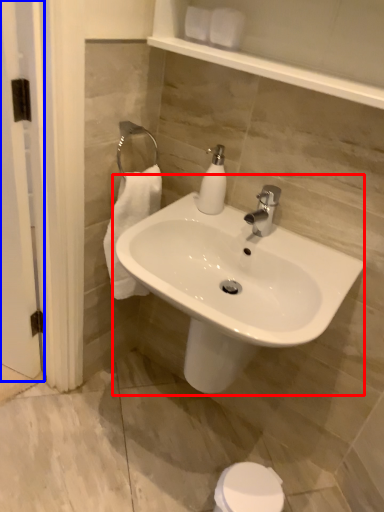
Question: Which object is further to the camera taking this photo, sink (highlighted by a red box) or screen door (highlighted by a blue box)?

Choices:
 (A) sink
 (B) screen door

Answer: (B)